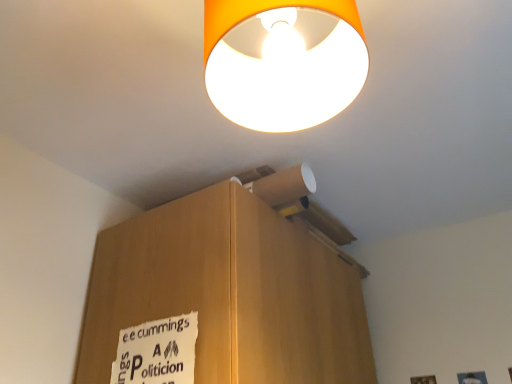
Question: Relative to orange matte lampshade at upper center, is white paper sign at lower left in front or behind?

Choices:
 (A) front
 (B) behind

Answer: (B)

Question: From a real-world perspective, is white paper sign at lower left above or below orange matte lampshade at upper center?

Choices:
 (A) below
 (B) above

Answer: (A)

Question: In the image, is white paper sign at lower left on the left side or the right side of orange matte lampshade at upper center?

Choices:
 (A) right
 (B) left

Answer: (B)

Question: Visually, is orange matte lampshade at upper center positioned to the left or to the right of white paper sign at lower left?

Choices:
 (A) right
 (B) left

Answer: (A)

Question: From the image's perspective, is orange matte lampshade at upper center located above or below white paper sign at lower left?

Choices:
 (A) below
 (B) above

Answer: (B)

Question: Looking at their shapes, would you say orange matte lampshade at upper center is wider or thinner than white paper sign at lower left?

Choices:
 (A) thin
 (B) wide

Answer: (B)

Question: Considering the positions of orange matte lampshade at upper center and white paper sign at lower left in the image, is orange matte lampshade at upper center taller or shorter than white paper sign at lower left?

Choices:
 (A) tall
 (B) short

Answer: (B)